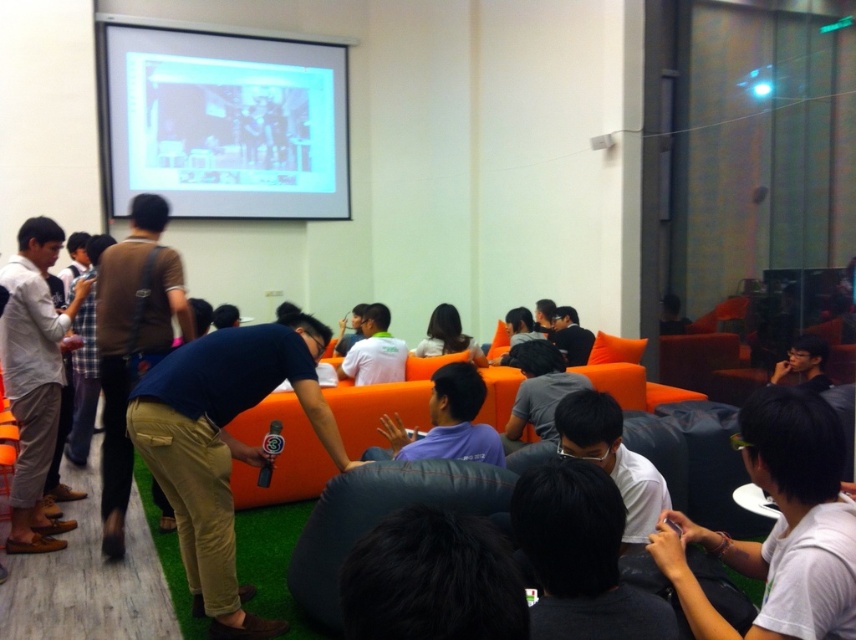
Question: Estimate the real-world distances between objects in this image. Which object is closer to the white shirt at center?

Choices:
 (A) blue cotton shirt at center
 (B) white glossy projection screen at upper center

Answer: (A)

Question: Observing the image, what is the correct spatial positioning of white matte shirt at lower right in reference to white shirt at center?

Choices:
 (A) below
 (B) above

Answer: (A)

Question: Estimate the real-world distances between objects in this image. Which object is farther from the blue cotton shirt at center?

Choices:
 (A) black fabric bean bag chair at lower center
 (B) brown fabric shirt at center
 (C) blue fabric shirt at center

Answer: (B)

Question: Can you confirm if brown fabric shirt at center is positioned to the left of light gray cotton pants at left?

Choices:
 (A) yes
 (B) no

Answer: (B)

Question: Does white glossy projection screen at upper center lie in front of smooth brown hair at center?

Choices:
 (A) yes
 (B) no

Answer: (B)

Question: Considering the real-world distances, which object is farthest from the smooth brown hair at center?

Choices:
 (A) white glossy projection screen at upper center
 (B) black fabric bean bag chair at lower center
 (C) brown fabric shirt at center
 (D) blue cotton shirt at center

Answer: (A)